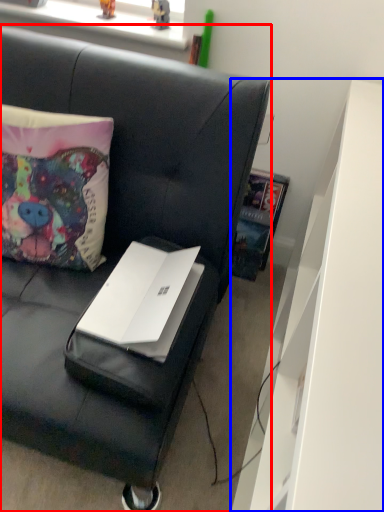
Question: Which point is closer to the camera, studio couch (highlighted by a red box) or dresser (highlighted by a blue box)?

Choices:
 (A) studio couch
 (B) dresser

Answer: (B)